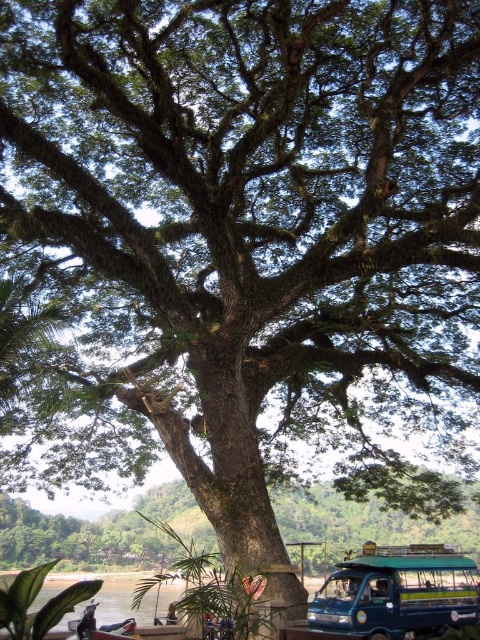
Question: Which point is farther from the camera taking this photo?

Choices:
 (A) (340, 529)
 (B) (431, 586)

Answer: (A)

Question: Which point is farther from the camera taking this photo?

Choices:
 (A) (154, 508)
 (B) (439, 593)

Answer: (A)

Question: Which of the following is the farthest from the observer?

Choices:
 (A) blue metallic van at lower right
 (B) green rough bark tree at center

Answer: (B)

Question: Does green rough bark tree at center appear over blue metallic van at lower right?

Choices:
 (A) no
 (B) yes

Answer: (A)

Question: Is green rough bark tree at center further to the viewer compared to blue metallic van at lower right?

Choices:
 (A) no
 (B) yes

Answer: (B)

Question: Can you confirm if green rough bark tree at center is positioned to the right of blue metallic van at lower right?

Choices:
 (A) no
 (B) yes

Answer: (A)